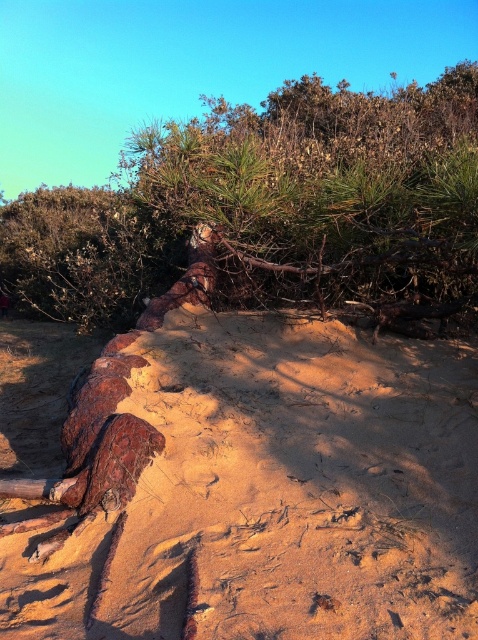
Consider the image. Which is above, rusty metallic log at lower left or brown bark tree at center?

brown bark tree at center

This screenshot has width=478, height=640. Describe the element at coordinates (268, 490) in the screenshot. I see `rusty metallic log at lower left` at that location.

Find the location of a particular element. The image size is (478, 640). rusty metallic log at lower left is located at coordinates (268, 490).